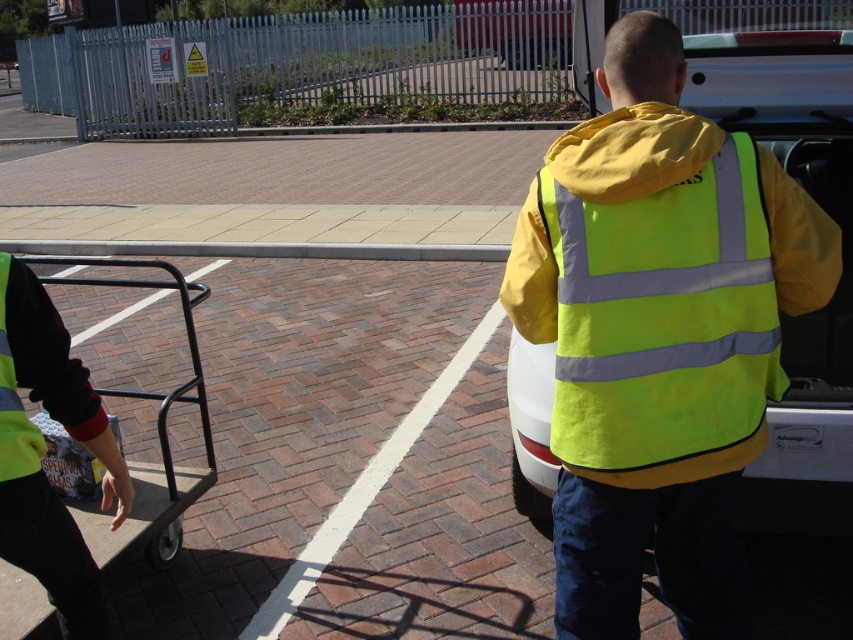
Looking at this image, does yellow reflective jacket at center come in front of black metal cart at lower left?

That is True.

Which is in front, point (833, 65) or point (155, 552)?

Positioned in front is point (833, 65).

This screenshot has width=853, height=640. Identify the location of yellow reflective jacket at center. (782, 296).